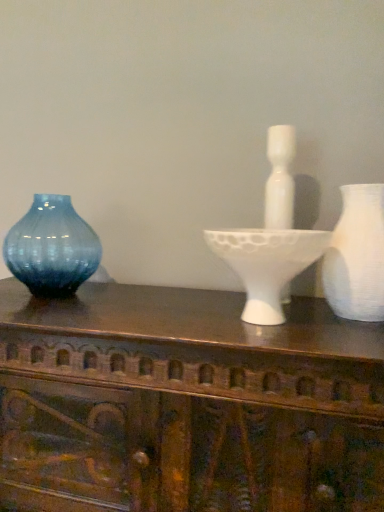
Find the location of a particular element. The height and width of the screenshot is (512, 384). white matte candle holder at center is located at coordinates (267, 264).

Describe the element at coordinates (52, 248) in the screenshot. I see `blue glass vase at left, acting as the first vase starting from the left` at that location.

I want to click on wooden carved table at center, so click(x=186, y=404).

From the image's perspective, which one is positioned lower, white matte candle holder at center or wooden carved table at center?

wooden carved table at center.

Which point is more forward, (247, 293) or (110, 327)?

The point (110, 327) is more forward.

Considering the sizes of white matte vase at right, the first vase when ordered from right to left, and wooden carved table at center in the image, is white matte vase at right, the first vase when ordered from right to left, taller or shorter than wooden carved table at center?

Clearly, white matte vase at right, the first vase when ordered from right to left, is shorter compared to wooden carved table at center.

Is white matte vase at right, the 2th vase when ordered from back to front, smaller than wooden carved table at center?

Indeed, white matte vase at right, the 2th vase when ordered from back to front, has a smaller size compared to wooden carved table at center.

From the image's perspective, does white matte vase at right, the 2th vase when ordered from back to front, appear lower than wooden carved table at center?

Actually, white matte vase at right, the 2th vase when ordered from back to front, appears above wooden carved table at center in the image.

In the scene shown: Can you confirm if white matte vase at right, the first vase when ordered from right to left, is positioned to the left of wooden carved table at center?

In fact, white matte vase at right, the first vase when ordered from right to left, is to the right of wooden carved table at center.

From the image's perspective, would you say wooden carved table at center is positioned over blue glass vase at left, acting as the first vase starting from the left?

Incorrect, from the image's perspective, wooden carved table at center is lower than blue glass vase at left, acting as the first vase starting from the left.

The height and width of the screenshot is (512, 384). I want to click on the 2nd vase above the wooden carved table at center (from the image's perspective), so click(x=52, y=248).

Are wooden carved table at center and blue glass vase at left, which is the second vase in right-to-left order, located far from each other?

They are positioned close to each other.

Is wooden carved table at center in front of or behind blue glass vase at left, the first vase viewed from the back, in the image?

In the image, wooden carved table at center appears in front of blue glass vase at left, the first vase viewed from the back.

Do you think wooden carved table at center is within white matte vase at right, which ranks as the first vase in front-to-back order, or outside of it?

The correct answer is: outside.

Identify the location of table that appears in front of the white matte vase at right, the first vase when ordered from right to left. [186, 404].

From the image's perspective, which object appears higher, wooden carved table at center or white matte vase at right, the first vase when ordered from right to left?

white matte vase at right, the first vase when ordered from right to left, is shown above in the image.

Which of these two, wooden carved table at center or white matte vase at right, the first vase when ordered from right to left, is wider?

wooden carved table at center is wider.

Based on the photo, from a real-world perspective, which is physically above, blue glass vase at left, positioned as the 2th vase in front-to-back order, or wooden carved table at center?

From a 3D spatial view, blue glass vase at left, positioned as the 2th vase in front-to-back order, is above.

What are the coordinates of `the 2nd vase above the wooden carved table at center (from the image's perspective)` in the screenshot? It's located at (52, 248).

In the scene shown: Considering the sizes of blue glass vase at left, positioned as the 2th vase in front-to-back order, and wooden carved table at center in the image, is blue glass vase at left, positioned as the 2th vase in front-to-back order, bigger or smaller than wooden carved table at center?

In the image, blue glass vase at left, positioned as the 2th vase in front-to-back order, appears to be smaller than wooden carved table at center.

Is white matte vase at right, which ranks as the first vase in front-to-back order, facing towards blue glass vase at left, the first vase viewed from the back?

No, white matte vase at right, which ranks as the first vase in front-to-back order, is not oriented towards blue glass vase at left, the first vase viewed from the back.

Considering the sizes of objects white matte vase at right, the first vase when ordered from right to left, and blue glass vase at left, positioned as the 2th vase in front-to-back order, in the image provided, who is thinner, white matte vase at right, the first vase when ordered from right to left, or blue glass vase at left, positioned as the 2th vase in front-to-back order,?

blue glass vase at left, positioned as the 2th vase in front-to-back order.

The height and width of the screenshot is (512, 384). What are the coordinates of `vase on the left of white matte vase at right, the 2th vase when ordered from back to front` in the screenshot? It's located at (52, 248).

From the picture: Is blue glass vase at left, positioned as the 2th vase in front-to-back order, not close to white matte candle holder at center?

blue glass vase at left, positioned as the 2th vase in front-to-back order, is actually quite close to white matte candle holder at center.

In the scene shown: How many degrees apart are the facing directions of blue glass vase at left, positioned as the 2th vase in front-to-back order, and white matte candle holder at center?

The angular difference between blue glass vase at left, positioned as the 2th vase in front-to-back order, and white matte candle holder at center is 0.315 degrees.

Considering the sizes of blue glass vase at left, which is the second vase in right-to-left order, and white matte candle holder at center in the image, is blue glass vase at left, which is the second vase in right-to-left order, taller or shorter than white matte candle holder at center?

Considering their sizes, blue glass vase at left, which is the second vase in right-to-left order, has more height than white matte candle holder at center.

Image resolution: width=384 pixels, height=512 pixels. What are the coordinates of `candle holder located above the wooden carved table at center (from a real-world perspective)` in the screenshot? It's located at (267, 264).

Locate an element on the screen. Image resolution: width=384 pixels, height=512 pixels. table in front of the white matte vase at right, the 2th vase when ordered from back to front is located at coordinates (186, 404).

Looking at the image, which one is located further to white matte vase at right, which is counted as the 2th vase, starting from the left, blue glass vase at left, the first vase viewed from the back, or wooden carved table at center?

Based on the image, blue glass vase at left, the first vase viewed from the back, appears to be further to white matte vase at right, which is counted as the 2th vase, starting from the left.

From the picture: Considering their positions, is blue glass vase at left, positioned as the 2th vase in front-to-back order, positioned closer to white matte candle holder at center than wooden carved table at center?

wooden carved table at center lies closer to white matte candle holder at center than the other object.

Estimate the real-world distances between objects in this image. Which object is closer to white matte vase at right, which ranks as the first vase in front-to-back order, wooden carved table at center or blue glass vase at left, acting as the first vase starting from the left?

Based on the image, wooden carved table at center appears to be nearer to white matte vase at right, which ranks as the first vase in front-to-back order.

Looking at the image, which one is located further to wooden carved table at center, white matte candle holder at center or white matte vase at right, the first vase when ordered from right to left?

Based on the image, white matte vase at right, the first vase when ordered from right to left, appears to be further to wooden carved table at center.

Considering their positions, is blue glass vase at left, acting as the first vase starting from the left, positioned further to white matte candle holder at center than white matte vase at right, which is counted as the 2th vase, starting from the left?

blue glass vase at left, acting as the first vase starting from the left, is positioned further to the anchor white matte candle holder at center.

Considering their positions, is wooden carved table at center positioned further to white matte candle holder at center than blue glass vase at left, positioned as the 2th vase in front-to-back order?

blue glass vase at left, positioned as the 2th vase in front-to-back order, lies further to white matte candle holder at center than the other object.

Estimate the real-world distances between objects in this image. Which object is closer to wooden carved table at center, white matte vase at right, the 2th vase when ordered from back to front, or blue glass vase at left, acting as the first vase starting from the left?

white matte vase at right, the 2th vase when ordered from back to front.

Consider the image. Estimate the real-world distances between objects in this image. Which object is closer to white matte candle holder at center, wooden carved table at center or white matte vase at right, which ranks as the first vase in front-to-back order?

white matte vase at right, which ranks as the first vase in front-to-back order.

The height and width of the screenshot is (512, 384). Find the location of `table located between blue glass vase at left, acting as the first vase starting from the left, and white matte vase at right, the 2th vase when ordered from back to front, in the left-right direction`. table located between blue glass vase at left, acting as the first vase starting from the left, and white matte vase at right, the 2th vase when ordered from back to front, in the left-right direction is located at coordinates (186, 404).

Find the location of a particular element. Image resolution: width=384 pixels, height=512 pixels. candle holder between wooden carved table at center and blue glass vase at left, positioned as the 2th vase in front-to-back order, from front to back is located at coordinates (267, 264).

Identify the location of candle holder between white matte vase at right, the 2th vase when ordered from back to front, and wooden carved table at center from top to bottom. (267, 264).

Where is `candle holder located between blue glass vase at left, acting as the first vase starting from the left, and white matte vase at right, which ranks as the first vase in front-to-back order, in the left-right direction`? The height and width of the screenshot is (512, 384). candle holder located between blue glass vase at left, acting as the first vase starting from the left, and white matte vase at right, which ranks as the first vase in front-to-back order, in the left-right direction is located at coordinates (267, 264).